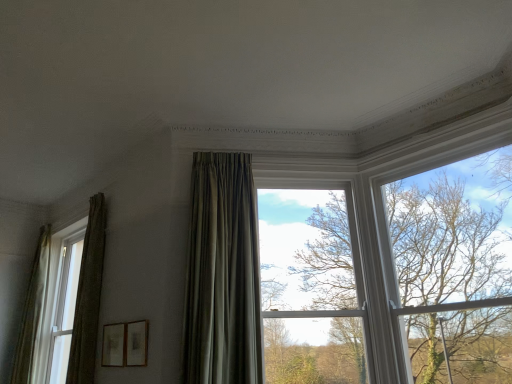
Question: Which direction should I rotate to look at clear glass window at center, which appears as the second window when viewed from the left, — up or down?

Choices:
 (A) down
 (B) up

Answer: (A)

Question: From the image's perspective, is green textured curtain at left, the second curtain in the left-to-right sequence, below matte white window at left, the 1th window when ordered from back to front?

Choices:
 (A) no
 (B) yes

Answer: (A)

Question: Is green textured curtain at left, the second curtain from the right, at the left side of matte white window at left, the second window viewed from the front?

Choices:
 (A) yes
 (B) no

Answer: (B)

Question: Is matte white window at left, the second window viewed from the front, surrounded by green textured curtain at left, acting as the 2th curtain starting from the back?

Choices:
 (A) no
 (B) yes

Answer: (A)

Question: Is green textured curtain at left, the second curtain from the right, not inside matte white window at left, the 1th window when ordered from back to front?

Choices:
 (A) no
 (B) yes

Answer: (B)

Question: Does green textured curtain at left, the second curtain in the left-to-right sequence, come behind matte white window at left, the 1th window when ordered from back to front?

Choices:
 (A) no
 (B) yes

Answer: (A)

Question: Is green textured curtain at left, the second curtain in the left-to-right sequence, closer to the viewer compared to matte white window at left, marked as the 2th window in a right-to-left arrangement?

Choices:
 (A) no
 (B) yes

Answer: (B)

Question: Is bare branches at upper right oriented towards matte white window at left, which is counted as the first window, starting from the left?

Choices:
 (A) yes
 (B) no

Answer: (B)

Question: Does bare branches at upper right come behind matte white window at left, the 1th window when ordered from back to front?

Choices:
 (A) yes
 (B) no

Answer: (B)

Question: Is bare branches at upper right positioned before matte white window at left, the 1th window when ordered from back to front?

Choices:
 (A) yes
 (B) no

Answer: (A)

Question: Is matte white window at left, the 1th window when ordered from back to front, a part of bare branches at upper right?

Choices:
 (A) no
 (B) yes

Answer: (A)

Question: Does bare branches at upper right have a greater height compared to matte white window at left, marked as the 2th window in a right-to-left arrangement?

Choices:
 (A) no
 (B) yes

Answer: (A)

Question: Does bare branches at upper right have a larger size compared to matte white window at left, marked as the 2th window in a right-to-left arrangement?

Choices:
 (A) yes
 (B) no

Answer: (B)

Question: From the image's perspective, is matte white window at left, which is counted as the first window, starting from the left, on top of satin green curtain at center, marked as the 1th curtain in a right-to-left arrangement?

Choices:
 (A) yes
 (B) no

Answer: (B)